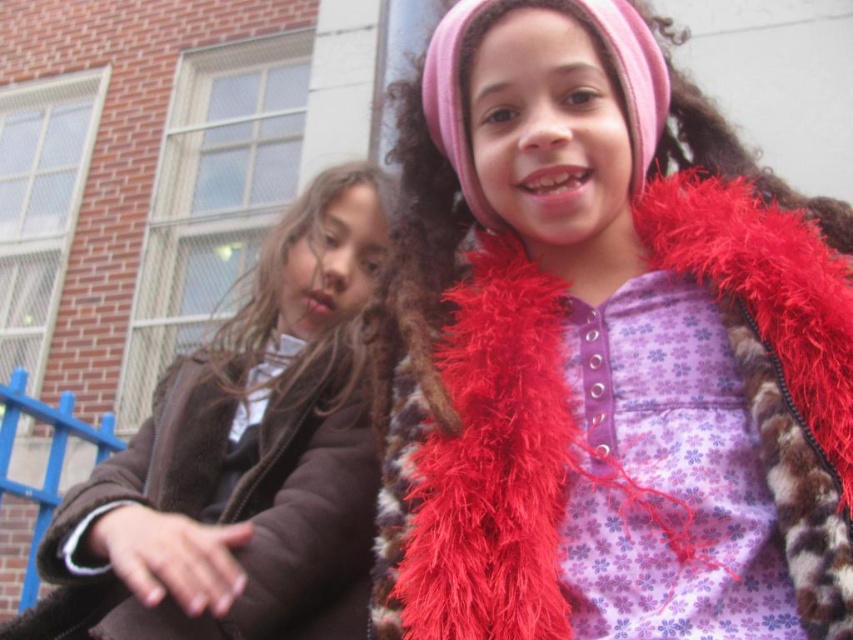
You are a photographer trying to capture both the fuzzy red scarf at upper right and the brown fuzzy coat at left in a single shot. Based on their positions, which object should you adjust your camera to focus on first to ensure both are in frame?

The fuzzy red scarf at upper right is to the right of brown fuzzy coat at left. To capture both in a single shot, focus on the brown fuzzy coat at left first, then adjust the camera to include the fuzzy red scarf at upper right on the right side of the frame.

You are a photographer standing 2 meters away from the two children. You want to capture both the fuzzy red scarf at upper right and the brown fuzzy coat at left in a single photo. Can you fit both in the frame if your camera has a 1.5 meter wide field of view?

The distance between the fuzzy red scarf at upper right and the brown fuzzy coat at left is 1.06 meters. Since your camera has a 1.5 meter wide field of view, which is wider than the distance between them, you can fit both in the frame.

You are a photographer trying to capture a closeup of the fuzzy red scarf at upper right. Based on its coordinates, where should you aim your camera?

The fuzzy red scarf at upper right is located at point 0.728 on the x axis and 0.571 on the y axis, so aim your camera at those coordinates to capture it.